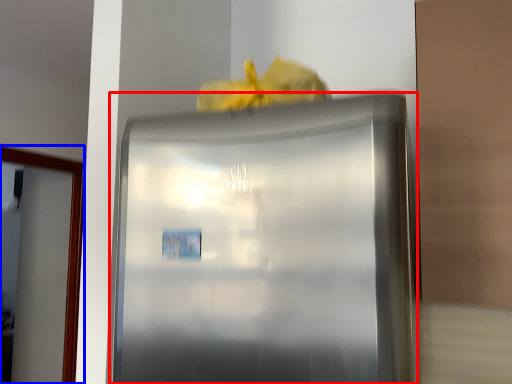
Question: Which object is closer to the camera taking this photo, refrigerator (highlighted by a red box) or glass door (highlighted by a blue box)?

Choices:
 (A) refrigerator
 (B) glass door

Answer: (A)